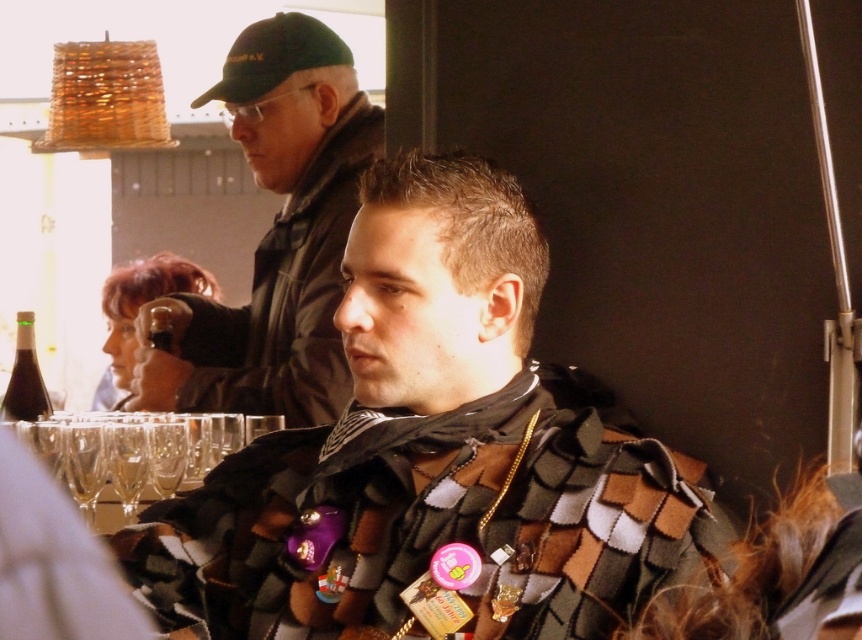
You are standing in the center of the image and want to locate the dark green cap at upper left. In which direction should you look to see it?

The dark green cap at upper left is located at coordinates 0.370 on the x axis and 0.320 on the y axis. Since you are at the center, you should look to the upper left direction to see it.